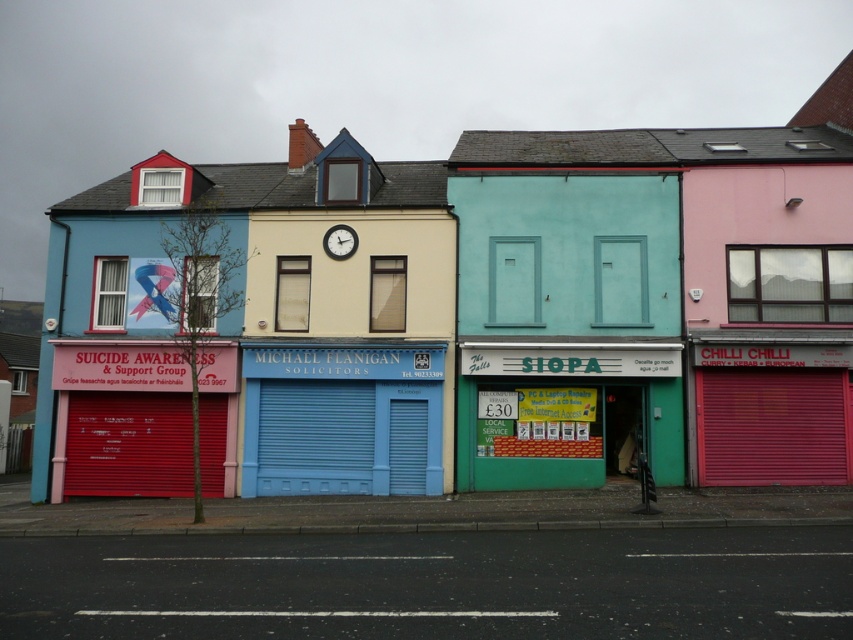
You are standing in front of the cream building. You see the red matte shutter at upper left and the matte black clock at center. Which object is closer to you?

The red matte shutter at upper left is closer to you because it is further to the viewer than the matte black clock at center.

You are a delivery person who needs to enter the building with the Suicide Awareness sign. The entrance is blocked by the red matte shutter at upper left. Can you go around it using the space next to the matte black clock at center?

The red matte shutter at upper left is larger in size than the matte black clock at center, so there might not be enough space to go around the shutter using the area next to the matte black clock at center.